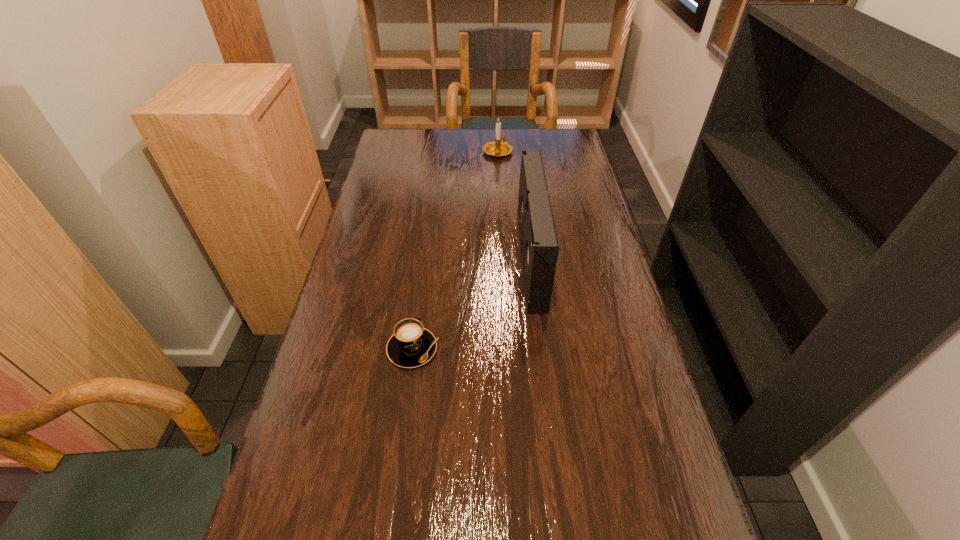
Where is `the second nearest object`? The width and height of the screenshot is (960, 540). the second nearest object is located at coordinates (539, 245).

You are a GUI agent. You are given a task and a screenshot of the screen. Output one action in this format:
    pyautogui.click(x=<x>, y=<y>)
    Task: Click on the tallest object
    This screenshot has height=540, width=960.
    Given the screenshot: What is the action you would take?
    pyautogui.click(x=539, y=245)

Where is `the second shortest object`? The image size is (960, 540). the second shortest object is located at coordinates (500, 147).

In order to click on the farthest object in this screenshot , I will do `click(500, 147)`.

The image size is (960, 540). What are the coordinates of `the shortest object` in the screenshot? It's located at (411, 345).

What are the coordinates of `the nearest object` in the screenshot? It's located at (411, 345).

Find the location of a particular element. This screenshot has width=960, height=540. vacant space located on the side of the tallest object with visible spindles is located at coordinates (407, 259).

The image size is (960, 540). Find the location of `vacant space situated on the side of the tallest object with visible spindles`. vacant space situated on the side of the tallest object with visible spindles is located at coordinates (463, 259).

I want to click on vacant position located 0.060m on the side of the tallest object with visible spindles, so click(x=500, y=259).

Where is `vacant space located on the front of the farthest object`? This screenshot has width=960, height=540. vacant space located on the front of the farthest object is located at coordinates (499, 171).